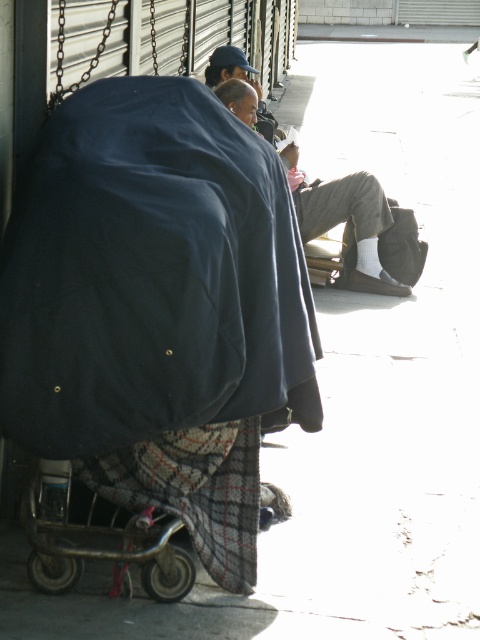
You are standing at the point labeled point (x=239, y=532). You want to walk to the entrance of the nearby coffee shop located 5 meters directly in front of you. Can you safely walk straight ahead without encountering any obstacles between you and the coffee shop entrance?

The distance between you and the entrance is 5 meters, but the point labeled point (x=239, y=532) is 3.68 meters away from the viewer. Since the coffee shop entrance is 5 meters ahead, you are already 3.68 meters closer, so there is 1.32 meters remaining. However, the scene description mentions a person sitting on a bench with a shopping cart in front of them. The cart might be blocking your path. Without specific information about the cart location relative to the path, it is uncertain if there are obstacles

You are a delivery person who needs to place a small package on the sidewalk. The package is 0.3 meters wide. There is a plaid fabric blanket at lower center located at point (193, 490). Is there enough space to place the package there without overlapping the plaid fabric blanket at lower center?

The plaid fabric blanket at lower center is located at point (193, 490). Since the package is 0.3 meters wide, you need to ensure there is sufficient space around the point to place it without overlapping. However, without knowing the exact dimensions of the area or the size of the blanket, it is impossible to determine if the space is adequate. Please check the available space before placing the package.